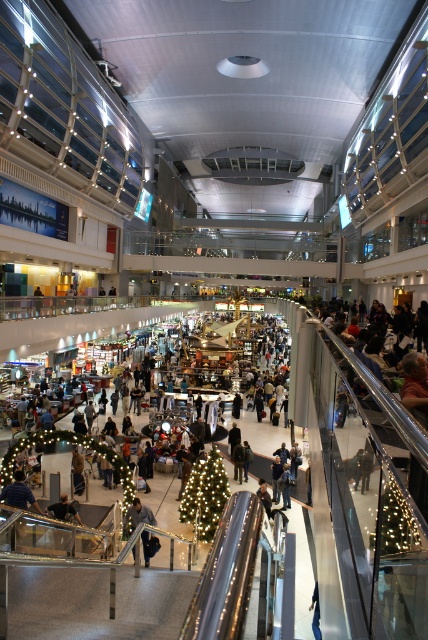
You are standing at the entrance of the mall and see a point marked at coordinates (x=205, y=493). Based on the scene description, can you determine which object this point belongs to?

The point at coordinates (x=205, y=493) is on the illuminated plastic christmas tree at center.

You are standing in the modern shopping mall and want to locate the illuminated plastic christmas tree at center. According to the coordinates provided, where should you look?

You should look at point (205, 493) to find the illuminated plastic christmas tree at center.